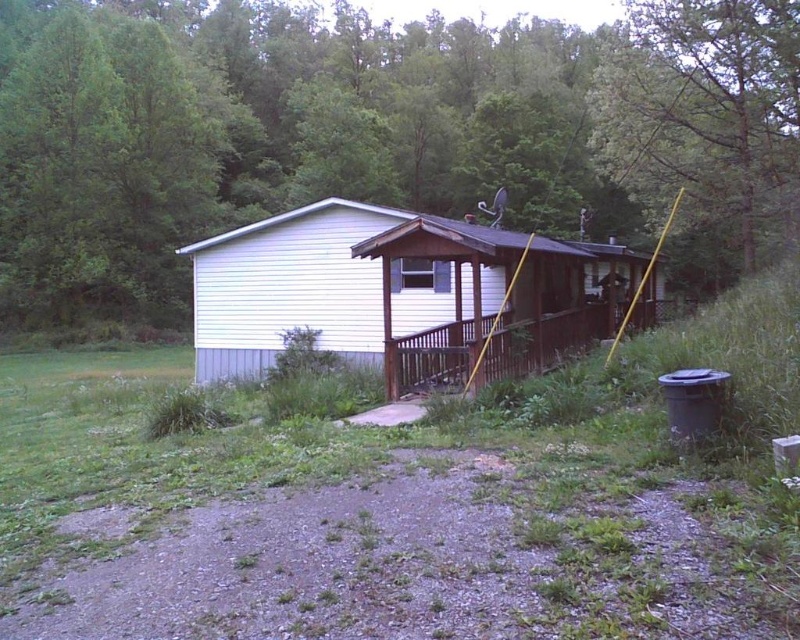
You are standing at the bottom of the stairs leading to the porch and want to take a photo of the white siding cabin at center without the green leafy tree at upper center blocking the view. Is it possible to do so without moving either object?

The green leafy tree at upper center is much taller than the white siding cabin at center, so it will likely block the view. To take a photo without the tree blocking the cabin, you would need to position yourself lower or find an angle where the tree is not in front of the cabin. However, since both objects are stationary, adjusting your viewpoint might be the only option available.

You are standing at the point marked by the coordinates point (401,292) in the image. Based on the scene description, what structure are you closest to?

The point (401,292) corresponds to the white siding cabin at center, so you are closest to the white siding cabin at center.